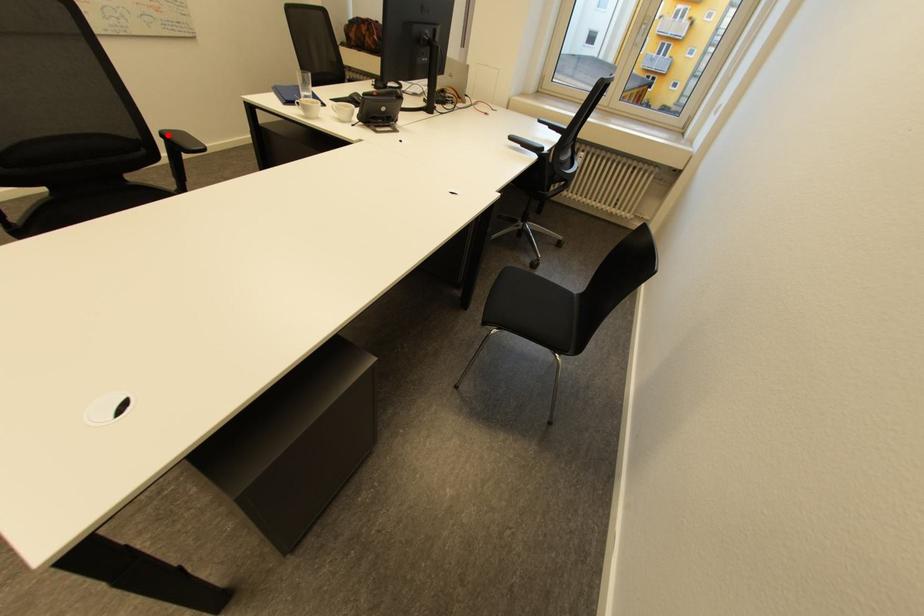
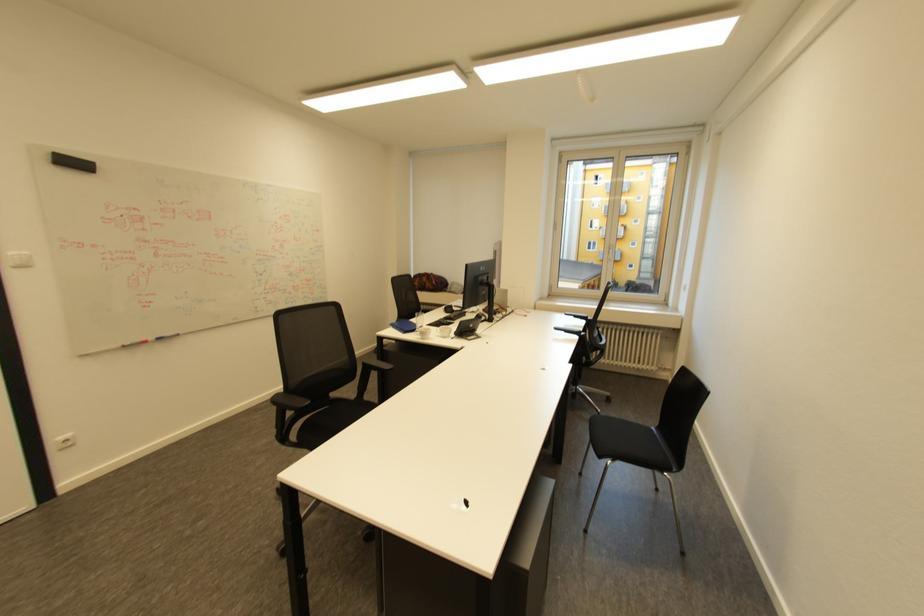
In the second image, find the point that corresponds to the highlighted location in the first image.

(370, 363)